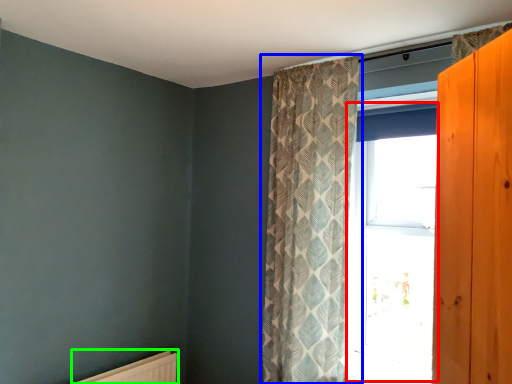
Question: Considering the real-world distances, which object is closest to window (highlighted by a red box)? curtain (highlighted by a blue box) or radiator (highlighted by a green box).

Choices:
 (A) curtain
 (B) radiator

Answer: (A)